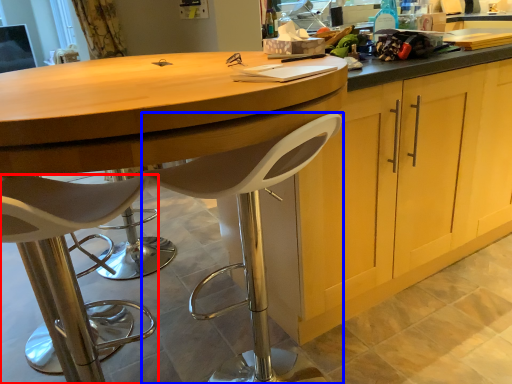
Question: Which object appears farthest to the camera in this image, chair (highlighted by a red box) or chair (highlighted by a blue box)?

Choices:
 (A) chair
 (B) chair

Answer: (B)